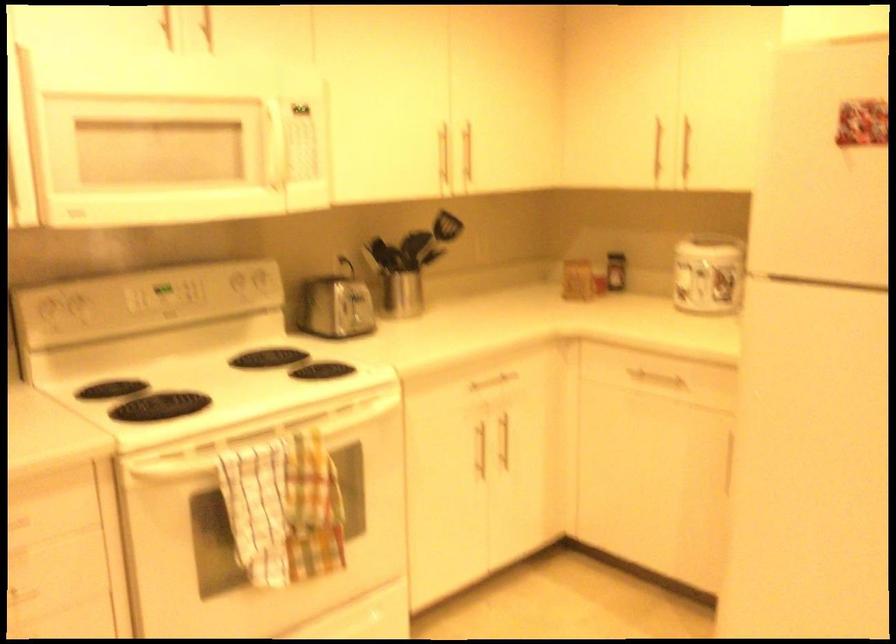
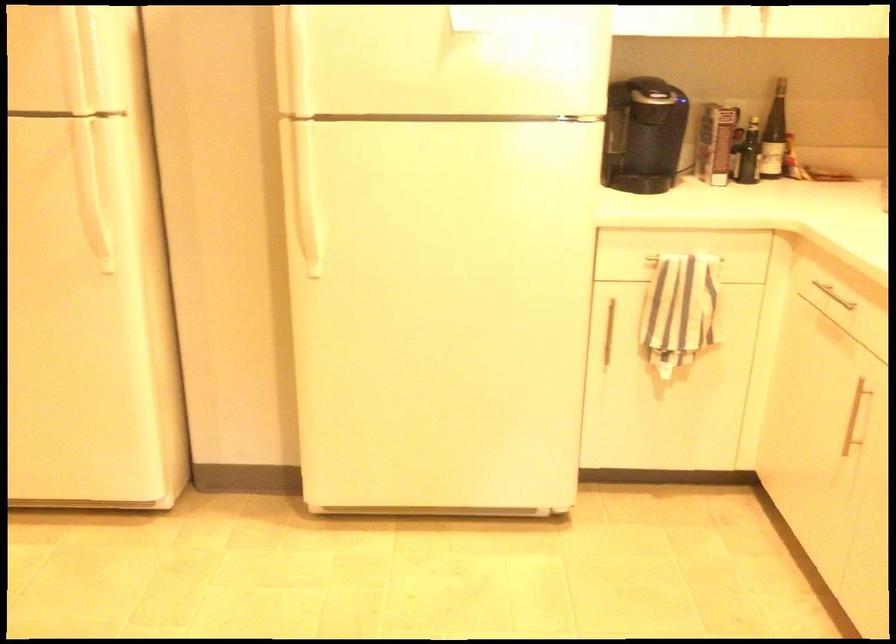
Question: How did the camera likely rotate?

Choices:
 (A) Left
 (B) Right
 (C) Up
 (D) Down

Answer: (B)